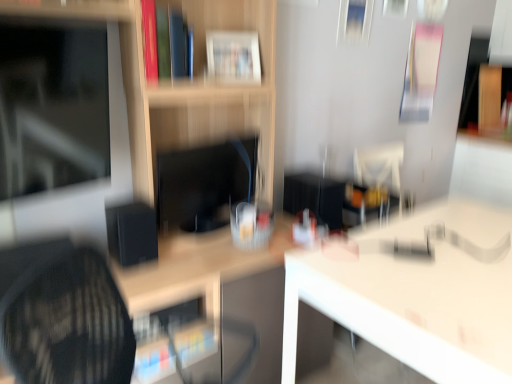
Question: Does wooden shelf at center have a greater width compared to white glossy table at center, which appears as the second table when viewed from the left?

Choices:
 (A) no
 (B) yes

Answer: (A)

Question: Is wooden shelf at center far away from white glossy table at center, which appears as the second table when viewed from the left?

Choices:
 (A) no
 (B) yes

Answer: (A)

Question: Is wooden shelf at center facing towards white glossy table at center, the first table from the right?

Choices:
 (A) no
 (B) yes

Answer: (B)

Question: Does wooden shelf at center have a smaller size compared to white glossy table at center, the first table from the right?

Choices:
 (A) yes
 (B) no

Answer: (B)

Question: Are wooden shelf at center and white glossy table at center, which appears as the second table when viewed from the left, beside each other?

Choices:
 (A) yes
 (B) no

Answer: (B)

Question: Is hardcover book at upper center, positioned as the second book in right-to-left order, spatially inside black matte speaker at center-left, or outside of it?

Choices:
 (A) inside
 (B) outside

Answer: (B)

Question: Is hardcover book at upper center, the first book in the left-to-right sequence, to the left or to the right of black matte speaker at center-left in the image?

Choices:
 (A) right
 (B) left

Answer: (A)

Question: Is hardcover book at upper center, the first book in the left-to-right sequence, bigger or smaller than black matte speaker at center-left?

Choices:
 (A) big
 (B) small

Answer: (A)

Question: Looking at their shapes, would you say hardcover book at upper center, positioned as the second book in right-to-left order, is wider or thinner than black matte speaker at center-left?

Choices:
 (A) thin
 (B) wide

Answer: (A)

Question: Considering the positions of point (155, 13) and point (220, 49), is point (155, 13) closer or farther from the camera than point (220, 49)?

Choices:
 (A) closer
 (B) farther

Answer: (A)

Question: Is hardcover book at upper center, acting as the first book starting from the front, wider or thinner than white glossy book at upper center, the 1th book viewed from the back?

Choices:
 (A) thin
 (B) wide

Answer: (B)

Question: Considering the relative positions of hardcover book at upper center, positioned as the second book in right-to-left order, and white glossy book at upper center, placed as the second book when sorted from front to back, in the image provided, is hardcover book at upper center, positioned as the second book in right-to-left order, to the left or to the right of white glossy book at upper center, placed as the second book when sorted from front to back,?

Choices:
 (A) right
 (B) left

Answer: (B)

Question: Considering the positions of hardcover book at upper center, the first book in the left-to-right sequence, and white glossy book at upper center, placed as the second book when sorted from front to back, in the image, is hardcover book at upper center, the first book in the left-to-right sequence, bigger or smaller than white glossy book at upper center, placed as the second book when sorted from front to back,?

Choices:
 (A) small
 (B) big

Answer: (B)

Question: From their relative heights in the image, would you say white glossy book at upper center, the 1th book in the right-to-left sequence, is taller or shorter than black matte speaker at center-left?

Choices:
 (A) short
 (B) tall

Answer: (A)

Question: From a real-world perspective, is white glossy book at upper center, placed as the second book when sorted from front to back, positioned above or below black matte speaker at center-left?

Choices:
 (A) above
 (B) below

Answer: (A)